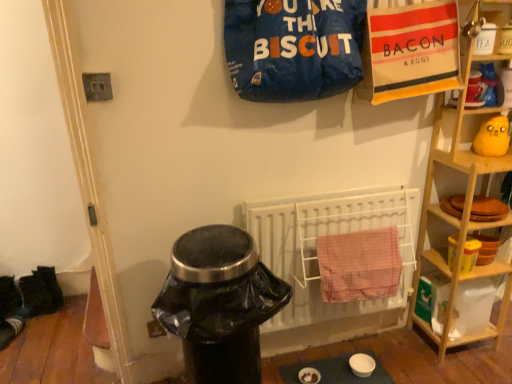
Locate an element on the screen. The image size is (512, 384). vacant space behind matte blue table at lower center is located at coordinates (329, 345).